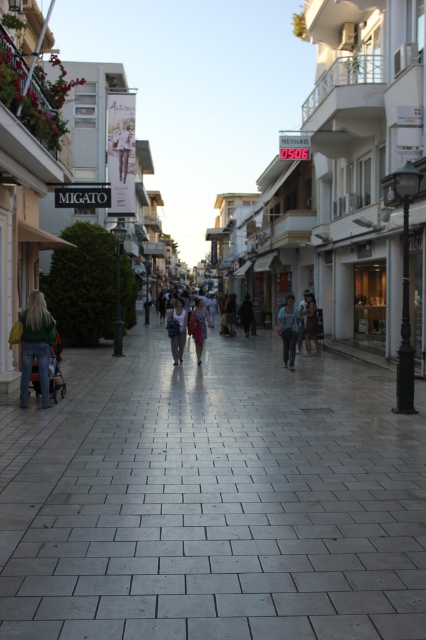
Can you confirm if dark blue jeans at center is wider than dark gray coat at center?

In fact, dark blue jeans at center might be narrower than dark gray coat at center.

Is dark blue jeans at center to the left of dark gray coat at center from the viewer's perspective?

No, dark blue jeans at center is not to the left of dark gray coat at center.

What do you see at coordinates (310, 323) in the screenshot? This screenshot has width=426, height=640. I see `dark blue jeans at center` at bounding box center [310, 323].

Where is `dark blue jeans at center`? The width and height of the screenshot is (426, 640). dark blue jeans at center is located at coordinates (310, 323).

Who is shorter, white glossy mall at center or dark gray coat at center?

Standing shorter between the two is dark gray coat at center.

Between point (275, 280) and point (241, 321), which one is positioned behind?

Point (275, 280)

Identify the location of white glossy mall at center. Image resolution: width=426 pixels, height=640 pixels. (348, 182).

You are a GUI agent. You are given a task and a screenshot of the screen. Output one action in this format:
    pyautogui.click(x=<x>, y=<y>)
    Task: Click on the white glossy mall at center
    The height and width of the screenshot is (640, 426).
    Given the screenshot: What is the action you would take?
    pyautogui.click(x=348, y=182)

Who is higher up, white glossy mall at center or dark blue jeans at center?

white glossy mall at center

Looking at this image, which of these two, white glossy mall at center or dark blue jeans at center, stands taller?

With more height is white glossy mall at center.

Is point (373, 144) farther from camera compared to point (314, 330)?

No, (373, 144) is in front of (314, 330).

Find the location of a particular element. white glossy mall at center is located at coordinates (348, 182).